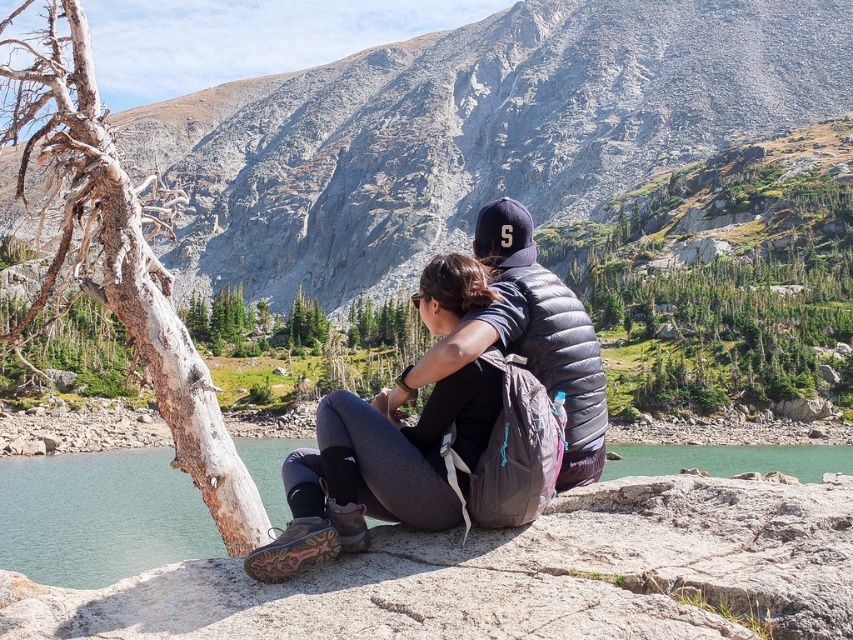
Question: Does matte gray rock at center appear on the left side of green smooth rock at lower center?

Choices:
 (A) no
 (B) yes

Answer: (B)

Question: Which point is farther to the camera?

Choices:
 (A) matte gray rock at center
 (B) gray bark tree at left

Answer: (A)

Question: Does matte gray rock at center have a larger size compared to matte black backpack at center?

Choices:
 (A) no
 (B) yes

Answer: (B)

Question: Which object is closer to the camera taking this photo?

Choices:
 (A) gray bark tree at left
 (B) matte black backpack at center
 (C) green smooth rock at lower center

Answer: (B)

Question: Which of the following is the farthest from the observer?

Choices:
 (A) matte black backpack at center
 (B) gray bark tree at left

Answer: (B)

Question: Is matte gray rock at center smaller than gray bark tree at left?

Choices:
 (A) no
 (B) yes

Answer: (A)